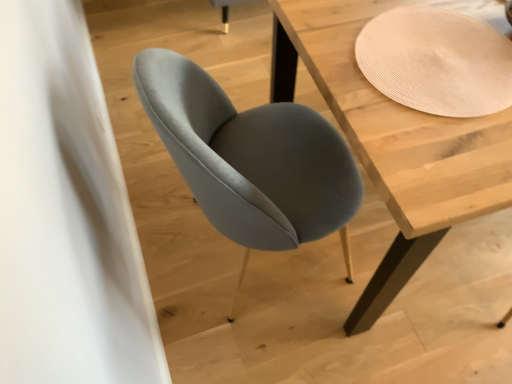
Question: Considering the relative sizes of light wood table at center and suede gray chair at center in the image provided, is light wood table at center shorter than suede gray chair at center?

Choices:
 (A) yes
 (B) no

Answer: (A)

Question: Does light wood table at center have a greater width compared to suede gray chair at center?

Choices:
 (A) no
 (B) yes

Answer: (B)

Question: Is light wood table at center outside suede gray chair at center?

Choices:
 (A) no
 (B) yes

Answer: (B)

Question: Would you say light wood table at center is a long distance from suede gray chair at center?

Choices:
 (A) yes
 (B) no

Answer: (B)

Question: Is light wood table at center to the right of suede gray chair at center from the viewer's perspective?

Choices:
 (A) yes
 (B) no

Answer: (A)

Question: Can you confirm if light wood table at center is bigger than suede gray chair at center?

Choices:
 (A) no
 (B) yes

Answer: (B)

Question: Can you confirm if suede gray chair at center is shorter than light wood table at center?

Choices:
 (A) yes
 (B) no

Answer: (B)

Question: Is suede gray chair at center at the left side of light wood table at center?

Choices:
 (A) yes
 (B) no

Answer: (A)

Question: Is suede gray chair at center wider than light wood table at center?

Choices:
 (A) no
 (B) yes

Answer: (A)

Question: Considering the relative sizes of suede gray chair at center and light wood table at center in the image provided, is suede gray chair at center thinner than light wood table at center?

Choices:
 (A) no
 (B) yes

Answer: (B)

Question: Is the depth of suede gray chair at center less than that of light wood table at center?

Choices:
 (A) yes
 (B) no

Answer: (A)

Question: Can you confirm if suede gray chair at center is bigger than light wood table at center?

Choices:
 (A) no
 (B) yes

Answer: (A)

Question: Would you say light wood table at center is to the left or to the right of suede gray chair at center in the picture?

Choices:
 (A) left
 (B) right

Answer: (B)